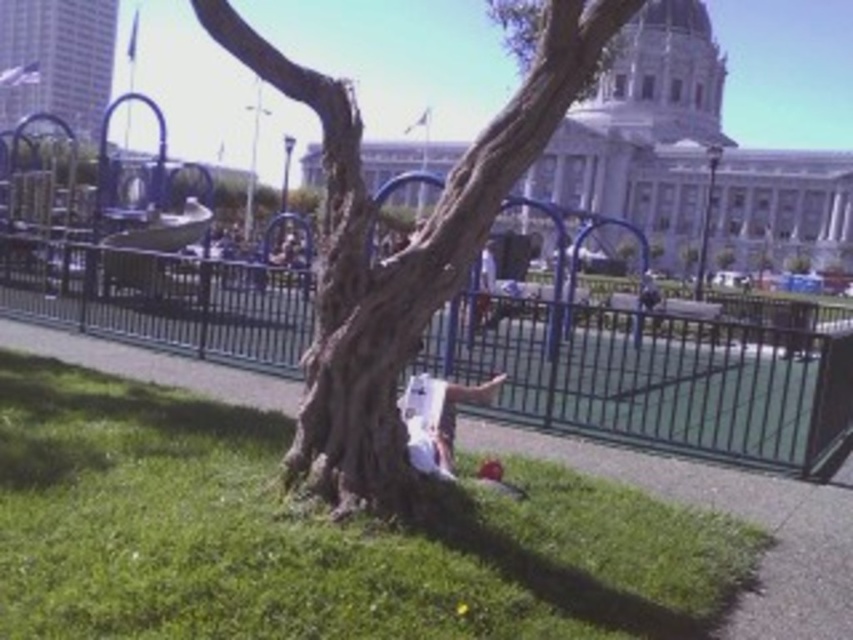
You are a painter setting up an easel to paint the scene. You need to ensure that your canvas is wide enough to capture both the black metal fence at center and the smooth bark tree at center. If your canvas is 2 meters wide, can it accommodate both objects side by side?

The black metal fence at center is wider than the smooth bark tree at center. Since the total width of both objects combined would exceed 2 meters, the canvas cannot accommodate both side by side.

You are standing in the park and want to reach the point marked at coordinates [612,353]. The path you need to take is 60 meters long. Will you be able to reach the point before the path ends?

The point marked at coordinates [612,353] is 57.45 meters away from the viewer, which is shorter than the 60 meter path. Therefore, you will reach the point before the path ends.